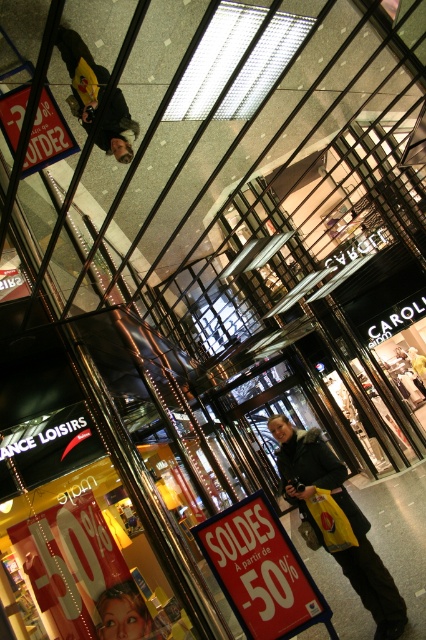
Does dark green jacket at center have a smaller size compared to red fabric sign at upper left?

No, dark green jacket at center is not smaller than red fabric sign at upper left.

Is dark green jacket at center closer to the viewer compared to red fabric sign at upper left?

No, it is behind red fabric sign at upper left.

What do you see at coordinates (336, 520) in the screenshot? I see `dark green jacket at center` at bounding box center [336, 520].

Where is `dark green jacket at center`? dark green jacket at center is located at coordinates (336, 520).

Can you confirm if red paper sign at center is shorter than matte black jacket at upper center?

Yes.

Which is more to the left, red paper sign at center or matte black jacket at upper center?

matte black jacket at upper center

Is point (316, 586) positioned behind point (74, 64)?

No.

I want to click on red paper sign at center, so click(x=261, y=572).

Does dark green jacket at center appear over matte black jacket at upper center?

Actually, dark green jacket at center is below matte black jacket at upper center.

Is dark green jacket at center taller than matte black jacket at upper center?

Correct, dark green jacket at center is much taller as matte black jacket at upper center.

Locate an element on the screen. The width and height of the screenshot is (426, 640). dark green jacket at center is located at coordinates (336, 520).

Where is `dark green jacket at center`? The width and height of the screenshot is (426, 640). dark green jacket at center is located at coordinates (336, 520).